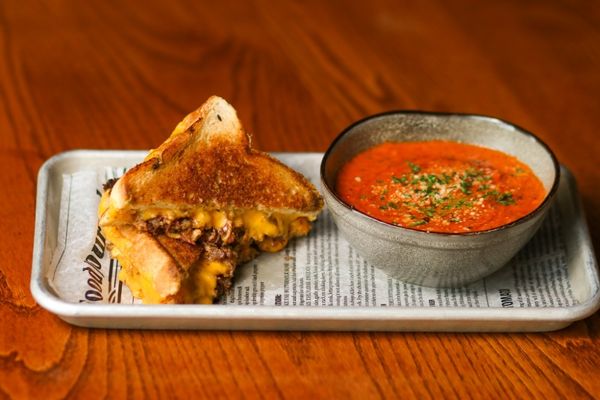
At what (x,y) coordinates should I click in order to perform the action: click on bowl. Please return your answer as a coordinate pair (x, y). This screenshot has width=600, height=400. Looking at the image, I should click on (433, 254).